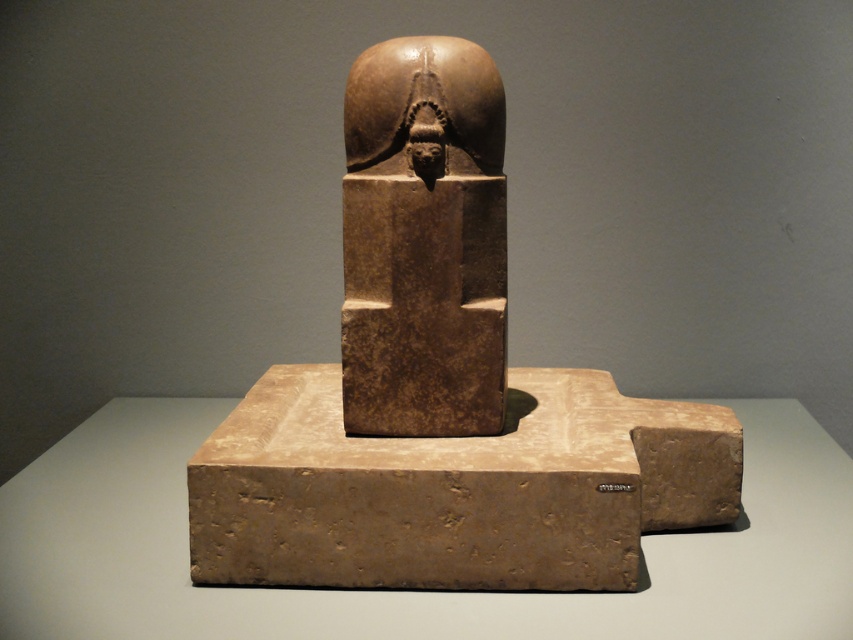
Is brown stone sculpture at center smaller than brown stone statue at center?

Incorrect, brown stone sculpture at center is not smaller in size than brown stone statue at center.

Between brown stone sculpture at center and brown stone statue at center, which one appears on the left side from the viewer's perspective?

brown stone statue at center is more to the left.

At what (x,y) coordinates should I click in order to perform the action: click on brown stone sculpture at center. Please return your answer as a coordinate pair (x, y). This screenshot has height=640, width=853. Looking at the image, I should click on (442, 390).

Consider the image. Can you confirm if brown stone sculpture at center is positioned to the left of brown stone head at center?

In fact, brown stone sculpture at center is to the right of brown stone head at center.

You are a GUI agent. You are given a task and a screenshot of the screen. Output one action in this format:
    pyautogui.click(x=<x>, y=<y>)
    Task: Click on the brown stone sculpture at center
    The height and width of the screenshot is (640, 853).
    Given the screenshot: What is the action you would take?
    pyautogui.click(x=442, y=390)

Does brown stone statue at center appear over brown stone head at center?

Actually, brown stone statue at center is below brown stone head at center.

Can you confirm if brown stone statue at center is wider than brown stone head at center?

Yes, brown stone statue at center is wider than brown stone head at center.

Is point (381, 177) positioned after point (474, 109)?

Yes, point (381, 177) is behind point (474, 109).

Identify the location of brown stone statue at center. This screenshot has width=853, height=640. (422, 241).